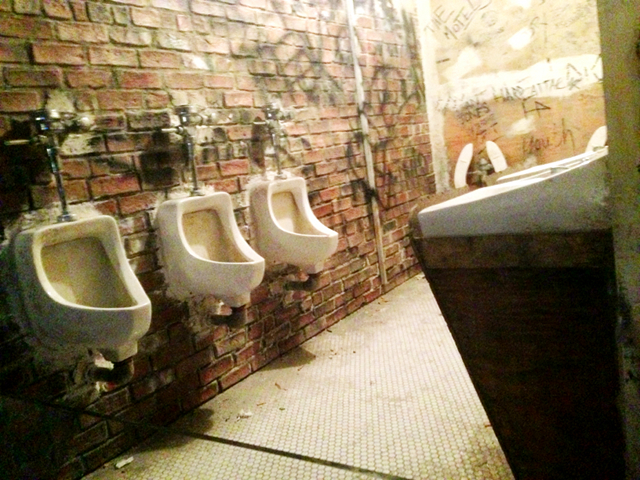
You are a GUI agent. You are given a task and a screenshot of the screen. Output one action in this format:
    pyautogui.click(x=<x>, y=<y>)
    Task: Click on the floor
    The image size is (640, 480).
    Given the screenshot: What is the action you would take?
    pyautogui.click(x=265, y=458), pyautogui.click(x=378, y=381)